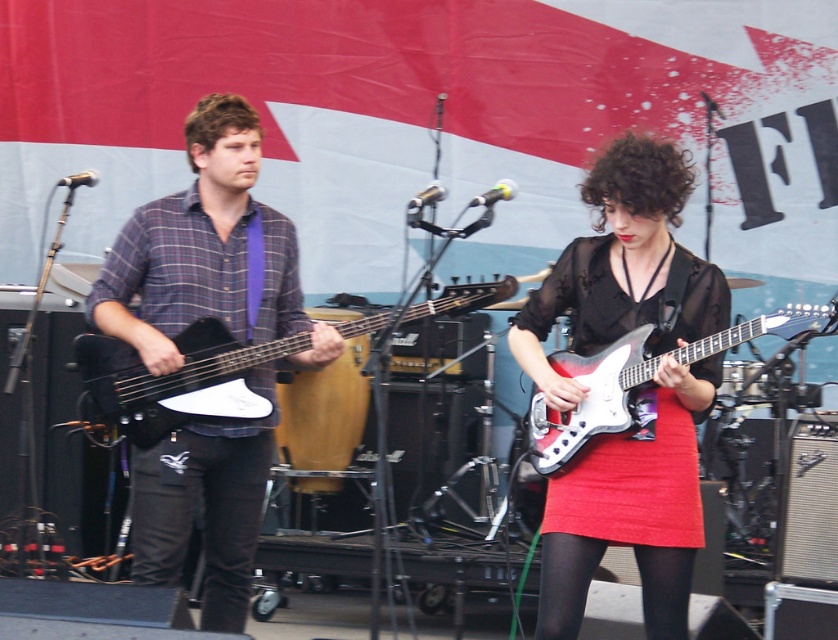
Does shiny black dress at center have a larger size compared to matte plaid shirt at center?

Incorrect, shiny black dress at center is not larger than matte plaid shirt at center.

Is point (606, 444) farther from camera compared to point (148, 317)?

No, (606, 444) is closer to viewer.

I want to click on shiny black dress at center, so click(630, 509).

Does matte plaid shirt at center have a smaller size compared to black denim pants at left?

No, matte plaid shirt at center is not smaller than black denim pants at left.

Is matte plaid shirt at center positioned at the back of black denim pants at left?

Yes, it is behind black denim pants at left.

Describe the element at coordinates (208, 252) in the screenshot. This screenshot has width=838, height=640. I see `matte plaid shirt at center` at that location.

Where is `matte plaid shirt at center`? Image resolution: width=838 pixels, height=640 pixels. matte plaid shirt at center is located at coordinates (208, 252).

Looking at this image, is shiny black dress at center wider than shiny metallic guitar at center?

Incorrect, shiny black dress at center's width does not surpass shiny metallic guitar at center's.

Who is more distant from viewer, [718,284] or [578,371]?

Positioned behind is point [718,284].

Does point (608, 534) lie behind point (758, 324)?

Yes, point (608, 534) is behind point (758, 324).

Find the location of a particular element. The height and width of the screenshot is (640, 838). shiny black dress at center is located at coordinates (630, 509).